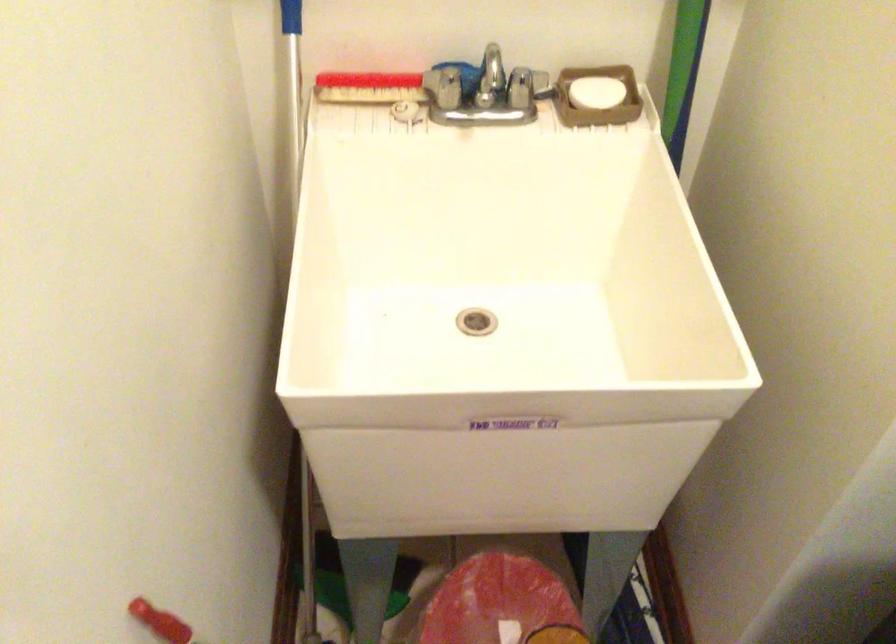
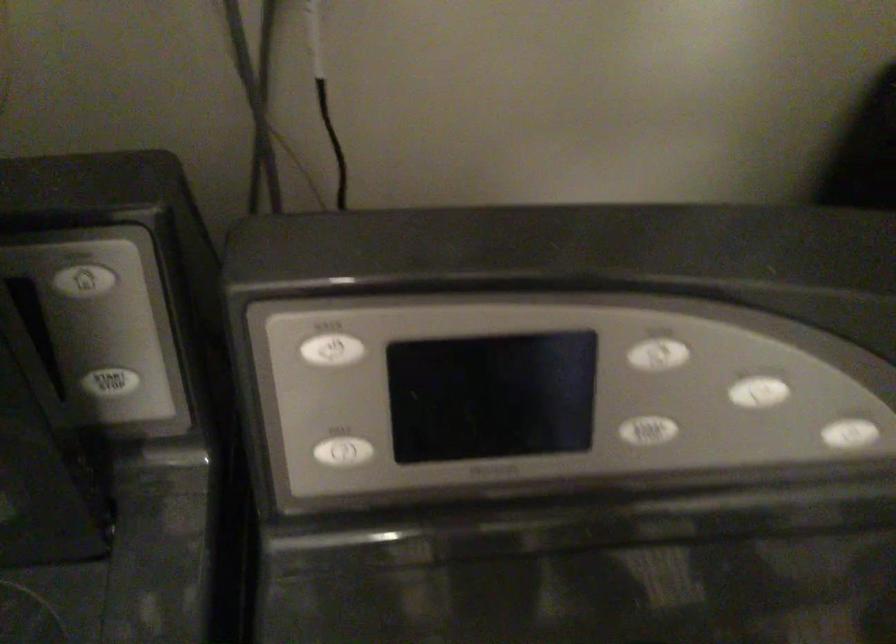
The images are taken continuously from a first-person perspective. In which direction is your viewpoint rotating?

The rotation direction of the camera is right-down.